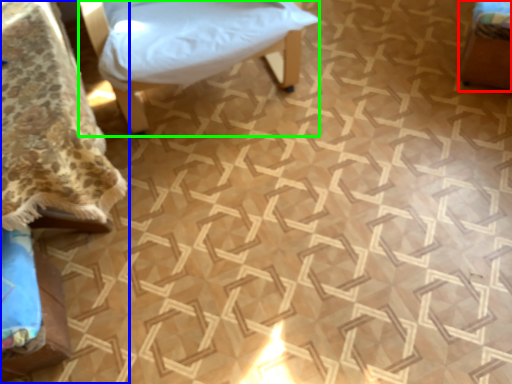
Question: Which object is the closest to the furniture (highlighted by a red box)? Choose among these: furniture (highlighted by a blue box) or furniture (highlighted by a green box).

Choices:
 (A) furniture
 (B) furniture

Answer: (B)